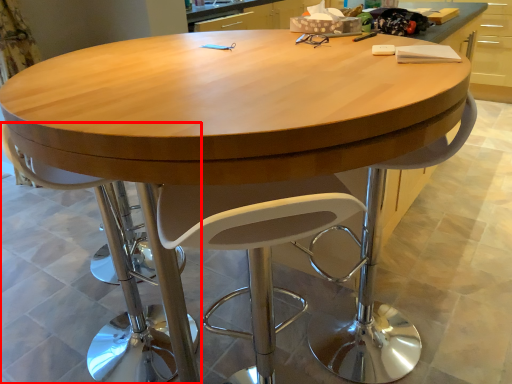
Question: Observing the image, what is the correct spatial positioning of chair (annotated by the red box) in reference to swivel chair?

Choices:
 (A) right
 (B) left

Answer: (B)